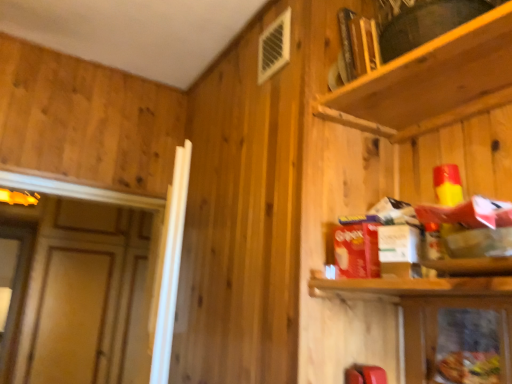
Question: Is wooden shelf at upper right directly adjacent to metallic silver cabinet at lower right?

Choices:
 (A) yes
 (B) no

Answer: (B)

Question: From the image's perspective, is wooden shelf at upper right located beneath metallic silver cabinet at lower right?

Choices:
 (A) yes
 (B) no

Answer: (B)

Question: Are wooden shelf at upper right and metallic silver cabinet at lower right far apart?

Choices:
 (A) no
 (B) yes

Answer: (A)

Question: From a real-world perspective, is wooden shelf at upper right on metallic silver cabinet at lower right?

Choices:
 (A) yes
 (B) no

Answer: (A)

Question: Does wooden shelf at upper right lie behind metallic silver cabinet at lower right?

Choices:
 (A) no
 (B) yes

Answer: (A)

Question: Does wooden shelf at upper right have a smaller size compared to metallic silver cabinet at lower right?

Choices:
 (A) yes
 (B) no

Answer: (B)

Question: Can you confirm if metallic silver cabinet at lower right is wider than wooden shelf at upper right?

Choices:
 (A) no
 (B) yes

Answer: (A)

Question: Does metallic silver cabinet at lower right appear on the right side of wooden shelf at upper right?

Choices:
 (A) no
 (B) yes

Answer: (B)

Question: From a real-world perspective, is metallic silver cabinet at lower right on wooden shelf at upper right?

Choices:
 (A) no
 (B) yes

Answer: (A)

Question: Can you see metallic silver cabinet at lower right touching wooden shelf at upper right?

Choices:
 (A) yes
 (B) no

Answer: (B)

Question: Can you confirm if metallic silver cabinet at lower right is bigger than wooden shelf at upper right?

Choices:
 (A) yes
 (B) no

Answer: (B)

Question: Is the depth of metallic silver cabinet at lower right less than that of wooden shelf at upper right?

Choices:
 (A) yes
 (B) no

Answer: (B)

Question: Looking at their shapes, would you say metallic silver cabinet at lower right is wider or thinner than wooden shelf at upper right?

Choices:
 (A) wide
 (B) thin

Answer: (B)